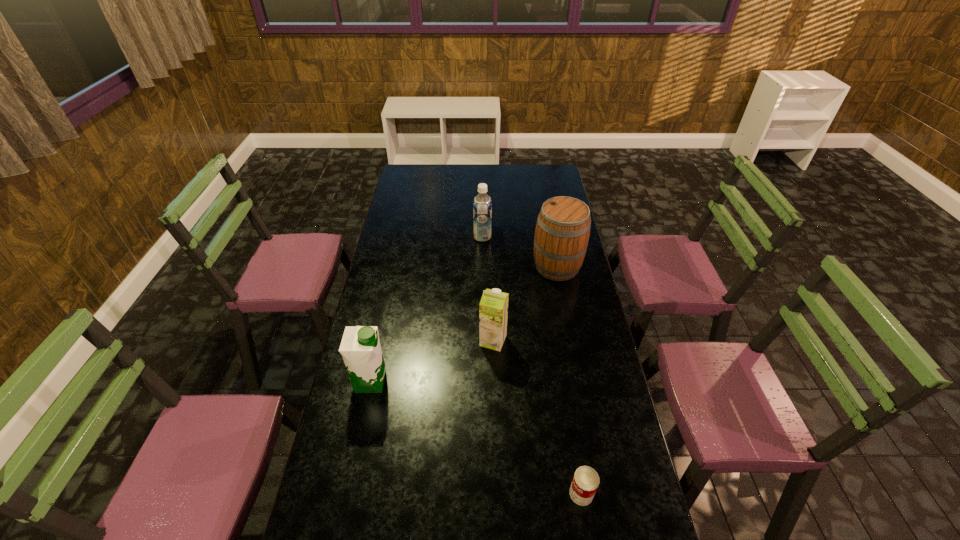
Where is `cider`? Image resolution: width=960 pixels, height=540 pixels. cider is located at coordinates (562, 231).

At what (x,y) coordinates should I click in order to perform the action: click on the farthest soya milk. Please return your answer as a coordinate pair (x, y). Image resolution: width=960 pixels, height=540 pixels. Looking at the image, I should click on (482, 204).

Where is `the leftmost soya milk`? Image resolution: width=960 pixels, height=540 pixels. the leftmost soya milk is located at coordinates (360, 347).

Locate an element on the screen. This screenshot has width=960, height=540. the leftmost object is located at coordinates (360, 347).

You are a GUI agent. You are given a task and a screenshot of the screen. Output one action in this format:
    pyautogui.click(x=<x>, y=<y>)
    Task: Click on the third farthest object
    The image size is (960, 540).
    Given the screenshot: What is the action you would take?
    pyautogui.click(x=493, y=309)

Identify the location of the nearest object. Image resolution: width=960 pixels, height=540 pixels. (585, 482).

Locate an element on the screen. can is located at coordinates (585, 482).

At what (x,y) coordinates should I click in order to perform the action: click on free space located 0.290m on the back of the cider. Please return your answer as a coordinate pair (x, y). The width and height of the screenshot is (960, 540). Looking at the image, I should click on (547, 214).

The height and width of the screenshot is (540, 960). I want to click on free space located on the label of the farthest soya milk, so click(x=420, y=237).

The height and width of the screenshot is (540, 960). Find the location of `vacant area located 0.370m on the label of the farthest soya milk`. vacant area located 0.370m on the label of the farthest soya milk is located at coordinates (396, 237).